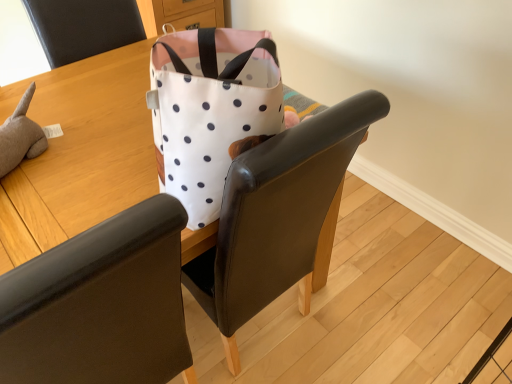
Question: Is matte black chair at upper left, which ranks as the 2th chair in bottom-to-top order, further to camera compared to white fabric bag at upper center?

Choices:
 (A) yes
 (B) no

Answer: (A)

Question: Is matte black chair at upper left, which ranks as the 2th chair in bottom-to-top order, in contact with white fabric bag at upper center?

Choices:
 (A) no
 (B) yes

Answer: (A)

Question: Considering the relative sizes of matte black chair at upper left, which is the first chair in top-to-bottom order, and white fabric bag at upper center in the image provided, is matte black chair at upper left, which is the first chair in top-to-bottom order, smaller than white fabric bag at upper center?

Choices:
 (A) yes
 (B) no

Answer: (A)

Question: Is matte black chair at upper left, which ranks as the 2th chair in bottom-to-top order, positioned in front of white fabric bag at upper center?

Choices:
 (A) yes
 (B) no

Answer: (B)

Question: From a real-world perspective, is matte black chair at upper left, which is the first chair in top-to-bottom order, physically below white fabric bag at upper center?

Choices:
 (A) no
 (B) yes

Answer: (A)

Question: In the image, is matte black chair at upper left, which ranks as the 2th chair in bottom-to-top order, on the left side or the right side of white fabric bag at upper center?

Choices:
 (A) left
 (B) right

Answer: (A)

Question: Looking at the image, does matte black chair at upper left, which ranks as the 2th chair in bottom-to-top order, seem bigger or smaller compared to white fabric bag at upper center?

Choices:
 (A) small
 (B) big

Answer: (A)

Question: Is point (75, 36) positioned closer to the camera than point (125, 162)?

Choices:
 (A) closer
 (B) farther

Answer: (B)

Question: Considering the positions of matte black chair at upper left, which ranks as the 2th chair in bottom-to-top order, and white fabric bag at upper center in the image, is matte black chair at upper left, which ranks as the 2th chair in bottom-to-top order, wider or thinner than white fabric bag at upper center?

Choices:
 (A) wide
 (B) thin

Answer: (B)

Question: Is point (49, 120) closer or farther from the camera than point (33, 278)?

Choices:
 (A) farther
 (B) closer

Answer: (A)

Question: Is white fabric bag at upper center wider or thinner than white fabric chair at upper center, arranged as the 2th chair when viewed from the top?

Choices:
 (A) wide
 (B) thin

Answer: (A)

Question: From a real-world perspective, is white fabric bag at upper center above or below white fabric chair at upper center, the first chair when ordered from bottom to top?

Choices:
 (A) below
 (B) above

Answer: (A)

Question: Is white fabric bag at upper center taller or shorter than white fabric chair at upper center, arranged as the 2th chair when viewed from the top?

Choices:
 (A) short
 (B) tall

Answer: (A)

Question: In terms of height, does white fabric bag at upper center look taller or shorter compared to matte black chair at upper left, which is the first chair in top-to-bottom order?

Choices:
 (A) tall
 (B) short

Answer: (A)

Question: From the image's perspective, is white fabric bag at upper center above or below matte black chair at upper left, which is the first chair in top-to-bottom order?

Choices:
 (A) above
 (B) below

Answer: (B)